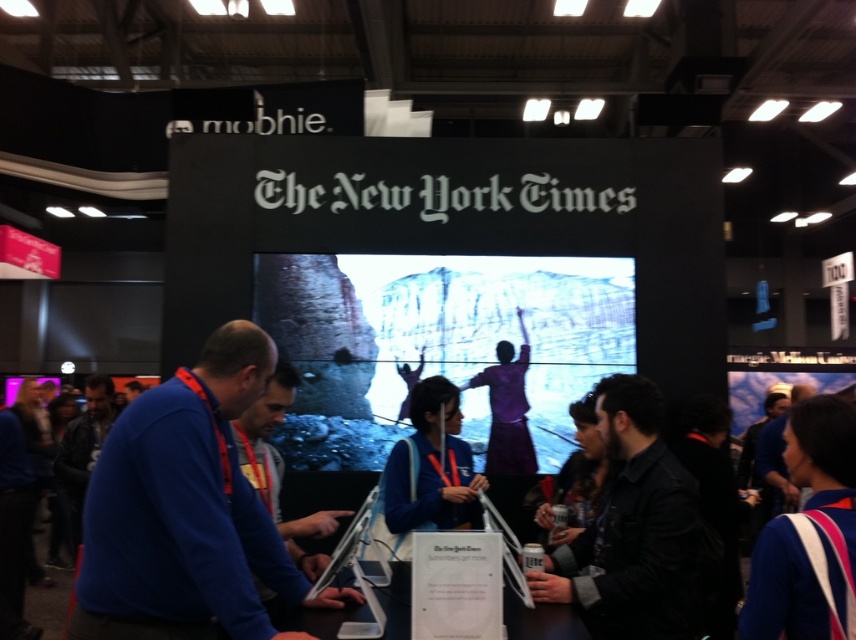
Question: Can you confirm if dark gray shirt at center is positioned above blue sweater at center?

Choices:
 (A) no
 (B) yes

Answer: (B)

Question: Which of the following is the closest to the observer?

Choices:
 (A) blue matte sweater at center
 (B) dark gray shirt at center
 (C) blue sweater at center
 (D) leather jacket at left

Answer: (A)

Question: Does leather jacket at left have a greater width compared to blue sweater at center?

Choices:
 (A) no
 (B) yes

Answer: (B)

Question: Does blue matte sweater at center appear on the left side of leather jacket at left?

Choices:
 (A) yes
 (B) no

Answer: (B)

Question: Among these points, which one is farthest from the camera?

Choices:
 (A) pyautogui.click(x=278, y=556)
 (B) pyautogui.click(x=140, y=387)
 (C) pyautogui.click(x=70, y=444)
 (D) pyautogui.click(x=634, y=580)

Answer: (B)

Question: Considering the real-world distances, which object is closest to the blue sweater at center?

Choices:
 (A) dark gray shirt at center
 (B) leather jacket at left
 (C) blue matte sweater at center

Answer: (B)